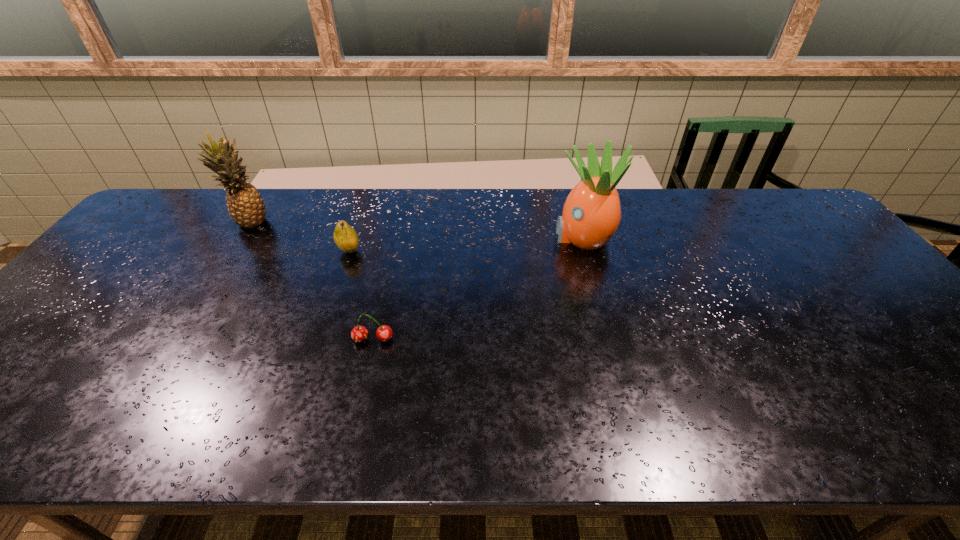
You are a GUI agent. You are given a task and a screenshot of the screen. Output one action in this format:
    pyautogui.click(x=<x>, y=<y>)
    Task: Click on the vacant region located 0.090m on the left of the pear
    
    Given the screenshot: What is the action you would take?
    pyautogui.click(x=306, y=251)

Find the location of `free space located with stems pointing upwards on the cherry`. free space located with stems pointing upwards on the cherry is located at coordinates (356, 416).

Identify the location of free region at the far edge. Image resolution: width=960 pixels, height=540 pixels. (498, 208).

Identify the location of vacant space at the near edge of the desktop. (390, 411).

This screenshot has height=540, width=960. Find the location of `vacant space at the left edge of the desktop`. vacant space at the left edge of the desktop is located at coordinates (38, 387).

The height and width of the screenshot is (540, 960). I want to click on free point at the right edge, so click(800, 253).

At what (x,y) coordinates should I click in order to perform the action: click on free region at the far left corner. Please return your answer as a coordinate pair (x, y). Looking at the image, I should click on (192, 200).

You are a GUI agent. You are given a task and a screenshot of the screen. Output one action in this format:
    pyautogui.click(x=<x>, y=<y>)
    Task: Click on the vacant space in between the left pineapple and the pear
    
    Given the screenshot: What is the action you would take?
    tap(300, 237)

Where is `free space between the leftmost object and the second shortest object`? The image size is (960, 540). free space between the leftmost object and the second shortest object is located at coordinates (300, 237).

Where is `free spot between the rightmost object and the third object from right to left`? This screenshot has height=540, width=960. free spot between the rightmost object and the third object from right to left is located at coordinates (466, 244).